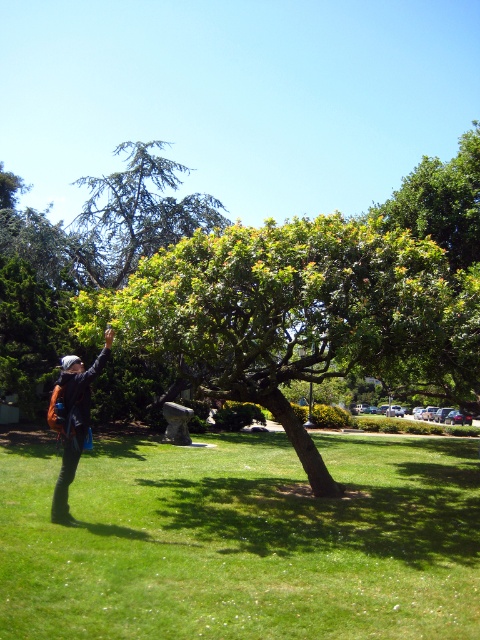
Question: Estimate the real-world distances between objects in this image. Which object is closer to the green grass at lower left?

Choices:
 (A) dark blue denim jacket at left
 (B) green leafy tree at center

Answer: (B)

Question: Which point is farther to the camera?

Choices:
 (A) green grass at lower left
 (B) dark blue denim jacket at left

Answer: (B)

Question: Among these objects, which one is farthest from the camera?

Choices:
 (A) green grass at lower left
 (B) green leafy tree at center
 (C) dark blue denim jacket at left

Answer: (B)

Question: Can you confirm if green grass at lower left is positioned to the left of green leafy tree at center?

Choices:
 (A) no
 (B) yes

Answer: (B)

Question: Is green leafy tree at center above dark blue denim jacket at left?

Choices:
 (A) no
 (B) yes

Answer: (B)

Question: Does green leafy tree at center appear over dark blue denim jacket at left?

Choices:
 (A) yes
 (B) no

Answer: (A)